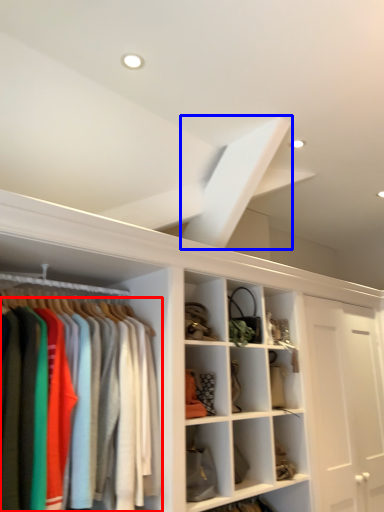
Question: Which of the following is the farthest to the observer, clothing (highlighted by a red box) or exhaust hood (highlighted by a blue box)?

Choices:
 (A) clothing
 (B) exhaust hood

Answer: (B)